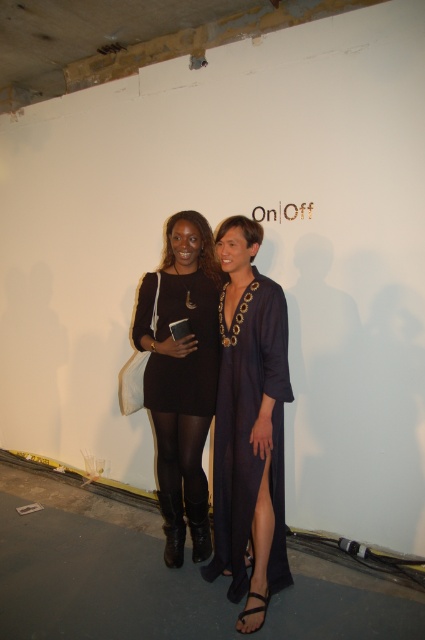
Can you confirm if navy satin dress at center is taller than black leather boots at lower center?

Correct, navy satin dress at center is much taller as black leather boots at lower center.

The image size is (425, 640). Find the location of `navy satin dress at center`. navy satin dress at center is located at coordinates [x=249, y=433].

Is point (235, 317) in front of point (186, 493)?

Yes, point (235, 317) is in front of point (186, 493).

At what (x,y) coordinates should I click in order to perform the action: click on navy satin dress at center. Please return your answer as a coordinate pair (x, y). The image size is (425, 640). Looking at the image, I should click on (249, 433).

Identify the location of matte black dress at center. (181, 376).

Is point (258, 372) closer to camera compared to point (181, 406)?

Yes, point (258, 372) is closer to viewer.

Between point (231, 353) and point (181, 289), which one is positioned in front?

Point (231, 353) is more forward.

Locate an element on the screen. navy satin dress at center is located at coordinates [x=249, y=433].